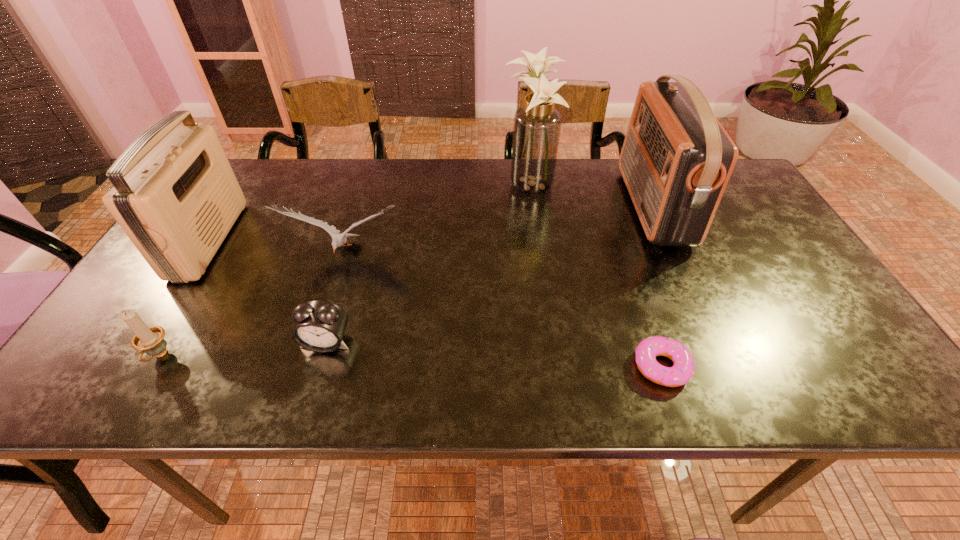
Where is `vacant space at the near right corner of the desktop`? vacant space at the near right corner of the desktop is located at coordinates (872, 381).

The width and height of the screenshot is (960, 540). I want to click on vacant area that lies between the fourth shortest object and the doughnut, so click(x=503, y=310).

The height and width of the screenshot is (540, 960). I want to click on free spot between the alarm clock and the doughnut, so click(x=494, y=354).

The width and height of the screenshot is (960, 540). What are the coordinates of `free area in between the fifth tallest object and the sixth tallest object` in the screenshot? It's located at (243, 349).

In order to click on free space between the left radio receiver and the flower arrangement in this screenshot , I will do `click(369, 213)`.

Image resolution: width=960 pixels, height=540 pixels. I want to click on free space between the rightmost object and the doughnut, so click(658, 286).

At what (x,y) coordinates should I click in order to perform the action: click on vacant space that's between the gull and the alarm clock. Please return your answer as a coordinate pair (x, y). Looking at the image, I should click on (336, 298).

Where is `free space that is in between the rightmost object and the fourth shortest object`? Image resolution: width=960 pixels, height=540 pixels. free space that is in between the rightmost object and the fourth shortest object is located at coordinates (499, 230).

This screenshot has width=960, height=540. Identify the location of vacant space in between the shortest object and the fourth tallest object. (503, 310).

Find the location of a particular element. This screenshot has height=540, width=960. free spot between the left radio receiver and the flower arrangement is located at coordinates (369, 213).